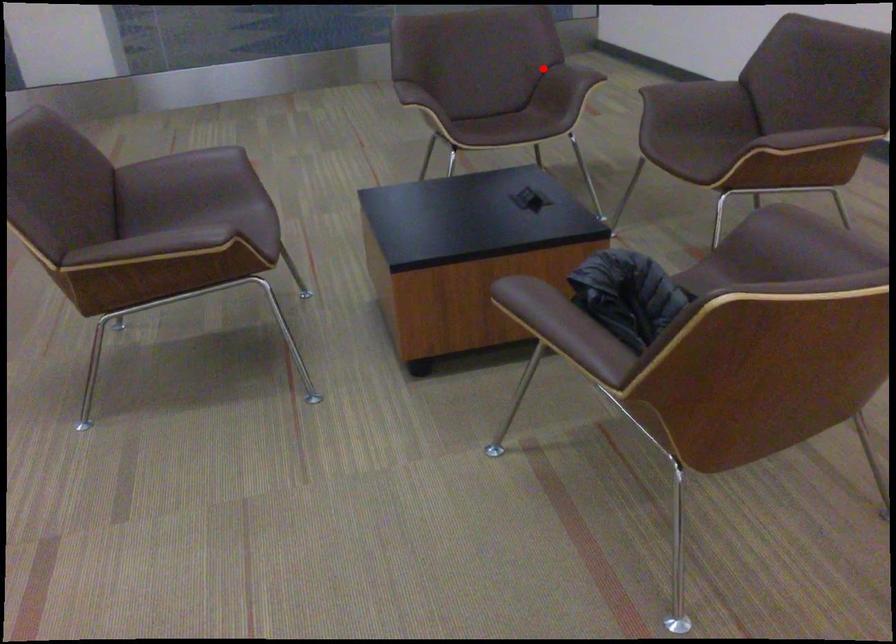
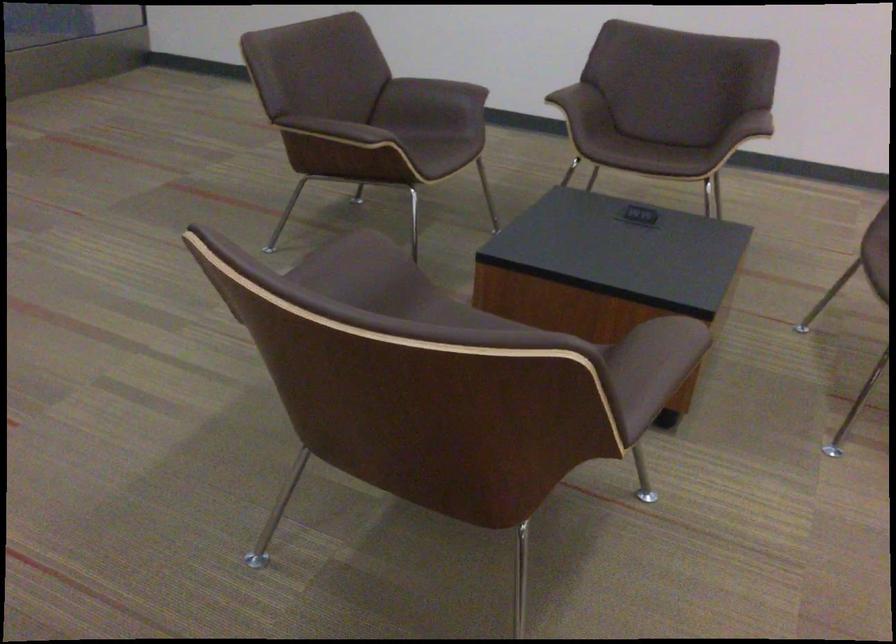
Locate, in the second image, the point that corresponds to the highlighted location in the first image.

(435, 90)